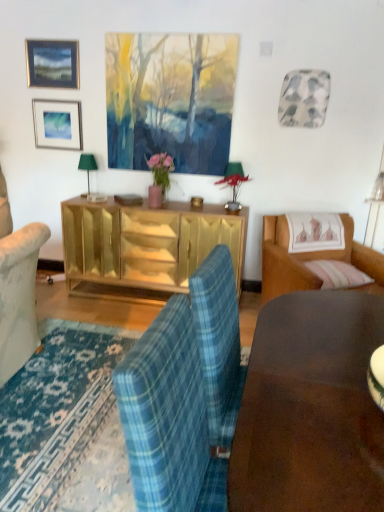
What is the approximate width of green fabric lampshade at left?

6.28 inches.

Find the location of `gold mirrored cabinet at center`. gold mirrored cabinet at center is located at coordinates (147, 243).

Where is `brown leather couch at right`? brown leather couch at right is located at coordinates (311, 260).

The image size is (384, 512). I want to click on matte silver picture frame at upper left, placed as the 2th picture frame when sorted from top to bottom, so click(x=57, y=124).

Considering the sizes of green fabric lampshade at left and brown leather couch at right in the image, is green fabric lampshade at left wider or thinner than brown leather couch at right?

In the image, green fabric lampshade at left appears to be more narrow than brown leather couch at right.

From the image's perspective, would you say green fabric lampshade at left is shown under brown leather couch at right?

Actually, green fabric lampshade at left appears above brown leather couch at right in the image.

Is brown leather couch at right at the back of green fabric lampshade at left?

No, green fabric lampshade at left's orientation is not away from brown leather couch at right.

Is green fabric lampshade at left not close to brown leather couch at right?

Yes.

Considering the points (351, 240) and (94, 205), which point is behind, point (351, 240) or point (94, 205)?

Positioned behind is point (94, 205).

Is brown leather couch at right inside or outside of gold mirrored cabinet at center?

brown leather couch at right exists outside the volume of gold mirrored cabinet at center.

Locate an element on the screen. The height and width of the screenshot is (512, 384). studio couch lying on the right of gold mirrored cabinet at center is located at coordinates (311, 260).

Does brown leather couch at right have a smaller size compared to gold mirrored cabinet at center?

No.

In the scene shown: From the image's perspective, is matte black picture frame at upper left, placed as the first picture frame when sorted from top to bottom, below matte silver picture frame at upper left, marked as the 1th picture frame in a bottom-to-top arrangement?

Incorrect, from the image's perspective, matte black picture frame at upper left, placed as the first picture frame when sorted from top to bottom, is higher than matte silver picture frame at upper left, marked as the 1th picture frame in a bottom-to-top arrangement.

From a real-world perspective, is matte black picture frame at upper left, the 2th picture frame from the bottom, over matte silver picture frame at upper left, marked as the 1th picture frame in a bottom-to-top arrangement?

Yes, from a real-world perspective, matte black picture frame at upper left, the 2th picture frame from the bottom, is on top of matte silver picture frame at upper left, marked as the 1th picture frame in a bottom-to-top arrangement.

Does matte black picture frame at upper left, the 2th picture frame from the bottom, have a lesser width compared to matte silver picture frame at upper left, marked as the 1th picture frame in a bottom-to-top arrangement?

Correct, the width of matte black picture frame at upper left, the 2th picture frame from the bottom, is less than that of matte silver picture frame at upper left, marked as the 1th picture frame in a bottom-to-top arrangement.

Is matte silver picture frame at upper left, placed as the 2th picture frame when sorted from top to bottom, inside matte black picture frame at upper left, the 2th picture frame from the bottom?

No, matte silver picture frame at upper left, placed as the 2th picture frame when sorted from top to bottom, is located outside of matte black picture frame at upper left, the 2th picture frame from the bottom.

Between brown leather couch at right and matte black picture frame at upper left, placed as the first picture frame when sorted from top to bottom, which one has less height?

matte black picture frame at upper left, placed as the first picture frame when sorted from top to bottom, is shorter.

Consider the image. How different are the orientations of brown leather couch at right and matte black picture frame at upper left, placed as the first picture frame when sorted from top to bottom, in degrees?

brown leather couch at right and matte black picture frame at upper left, placed as the first picture frame when sorted from top to bottom, are facing 27.6 degrees away from each other.

Can you see brown leather couch at right touching matte black picture frame at upper left, placed as the first picture frame when sorted from top to bottom?

There is a gap between brown leather couch at right and matte black picture frame at upper left, placed as the first picture frame when sorted from top to bottom.

Looking at this image, which object is closer to the camera taking this photo, brown leather couch at right or matte black picture frame at upper left, placed as the first picture frame when sorted from top to bottom?

brown leather couch at right is closer to the camera.

Is gold mirrored cabinet at center positioned with its back to brown leather couch at right?

No, gold mirrored cabinet at center is not facing away from brown leather couch at right.

Can you confirm if gold mirrored cabinet at center is positioned to the right of brown leather couch at right?

No.

Does gold mirrored cabinet at center have a larger size compared to brown leather couch at right?

No.

Between gold mirrored cabinet at center and brown leather couch at right, which one is positioned in front?

brown leather couch at right is in front.

Is matte silver picture frame at upper left, placed as the 2th picture frame when sorted from top to bottom, completely or partially outside of matte black picture frame at upper left, placed as the first picture frame when sorted from top to bottom?

matte silver picture frame at upper left, placed as the 2th picture frame when sorted from top to bottom, is positioned outside matte black picture frame at upper left, placed as the first picture frame when sorted from top to bottom.

Does point (75, 102) come behind point (65, 82)?

Yes, it is.

Is matte silver picture frame at upper left, placed as the 2th picture frame when sorted from top to bottom, oriented away from matte black picture frame at upper left, placed as the first picture frame when sorted from top to bottom?

No, matte silver picture frame at upper left, placed as the 2th picture frame when sorted from top to bottom, is not facing the opposite direction of matte black picture frame at upper left, placed as the first picture frame when sorted from top to bottom.

How far apart are matte silver picture frame at upper left, marked as the 1th picture frame in a bottom-to-top arrangement, and matte black picture frame at upper left, the 2th picture frame from the bottom?

A distance of 11.73 inches exists between matte silver picture frame at upper left, marked as the 1th picture frame in a bottom-to-top arrangement, and matte black picture frame at upper left, the 2th picture frame from the bottom.

From a real-world perspective, is gold mirrored cabinet at center above or below green fabric lampshade at left?

From a real-world perspective, gold mirrored cabinet at center is physically below green fabric lampshade at left.

Identify the location of lamp above the gold mirrored cabinet at center (from the image's perspective). (87, 166).

From the image's perspective, which one is positioned lower, gold mirrored cabinet at center or green fabric lampshade at left?

gold mirrored cabinet at center appears lower in the image.

Considering the sizes of objects gold mirrored cabinet at center and green fabric lampshade at left in the image provided, who is shorter, gold mirrored cabinet at center or green fabric lampshade at left?

green fabric lampshade at left is shorter.

The image size is (384, 512). Find the location of `studio couch below the green fabric lampshade at left (from the image's perspective)`. studio couch below the green fabric lampshade at left (from the image's perspective) is located at coordinates (311, 260).

The image size is (384, 512). In order to click on cabinetry that is under the brown leather couch at right (from a real-world perspective) in this screenshot , I will do `click(147, 243)`.

Which object lies nearer to the anchor point gold mirrored cabinet at center, matte black picture frame at upper left, placed as the first picture frame when sorted from top to bottom, or brown leather couch at right?

The object closer to gold mirrored cabinet at center is brown leather couch at right.

From the image, which object appears to be farther from brown wood desk at lower right, matte silver picture frame at upper left, marked as the 1th picture frame in a bottom-to-top arrangement, or brown leather couch at right?

Among the two, matte silver picture frame at upper left, marked as the 1th picture frame in a bottom-to-top arrangement, is located further to brown wood desk at lower right.

Based on their spatial positions, is matte silver picture frame at upper left, marked as the 1th picture frame in a bottom-to-top arrangement, or matte black picture frame at upper left, placed as the first picture frame when sorted from top to bottom, further from brown leather couch at right?

The object further to brown leather couch at right is matte black picture frame at upper left, placed as the first picture frame when sorted from top to bottom.

Considering their positions, is green fabric lampshade at left positioned further to brown wood desk at lower right than matte silver picture frame at upper left, marked as the 1th picture frame in a bottom-to-top arrangement?

The object further to brown wood desk at lower right is matte silver picture frame at upper left, marked as the 1th picture frame in a bottom-to-top arrangement.

When comparing their distances from brown leather couch at right, does matte silver picture frame at upper left, marked as the 1th picture frame in a bottom-to-top arrangement, or brown wood desk at lower right seem closer?

brown wood desk at lower right is closer to brown leather couch at right.

When comparing their distances from matte silver picture frame at upper left, placed as the 2th picture frame when sorted from top to bottom, does brown leather couch at right or gold mirrored cabinet at center seem further?

Based on the image, brown leather couch at right appears to be further to matte silver picture frame at upper left, placed as the 2th picture frame when sorted from top to bottom.

Based on their spatial positions, is brown wood desk at lower right or matte silver picture frame at upper left, marked as the 1th picture frame in a bottom-to-top arrangement, closer to gold mirrored cabinet at center?

matte silver picture frame at upper left, marked as the 1th picture frame in a bottom-to-top arrangement.

Looking at the image, which one is located closer to matte silver picture frame at upper left, placed as the 2th picture frame when sorted from top to bottom, brown wood desk at lower right or gold mirrored cabinet at center?

gold mirrored cabinet at center is positioned closer to the anchor matte silver picture frame at upper left, placed as the 2th picture frame when sorted from top to bottom.

The height and width of the screenshot is (512, 384). Find the location of `cabinetry positioned between brown wood desk at lower right and matte silver picture frame at upper left, placed as the 2th picture frame when sorted from top to bottom, from near to far`. cabinetry positioned between brown wood desk at lower right and matte silver picture frame at upper left, placed as the 2th picture frame when sorted from top to bottom, from near to far is located at coordinates (147, 243).

Locate an element on the screen. picture frame between matte black picture frame at upper left, placed as the first picture frame when sorted from top to bottom, and gold mirrored cabinet at center in the up-down direction is located at coordinates (57, 124).

Identify the location of cabinetry positioned between brown wood desk at lower right and matte black picture frame at upper left, the 2th picture frame from the bottom, from near to far. (147, 243).

At what (x,y) coordinates should I click in order to perform the action: click on lamp between matte black picture frame at upper left, placed as the first picture frame when sorted from top to bottom, and brown leather couch at right, in the horizontal direction. Please return your answer as a coordinate pair (x, y). Looking at the image, I should click on (87, 166).